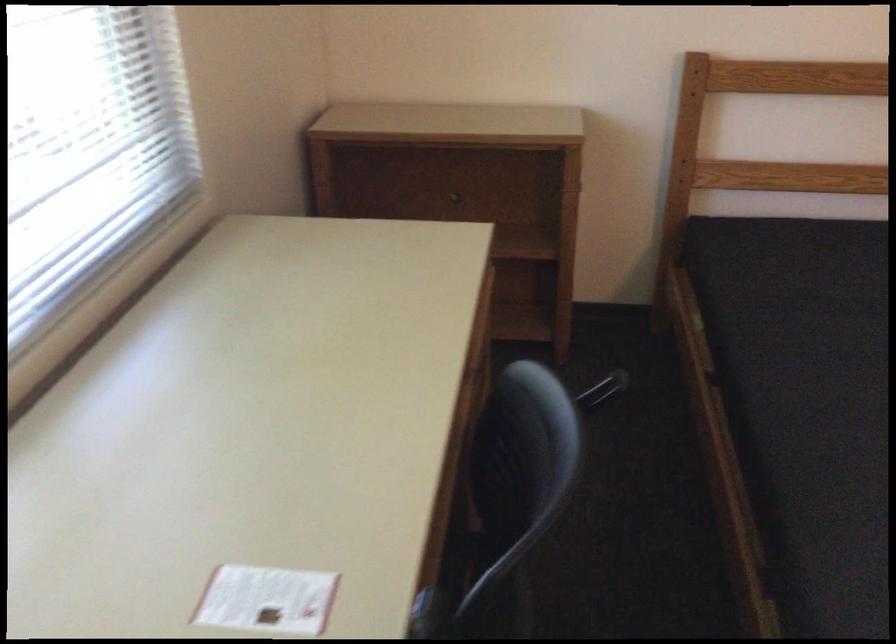
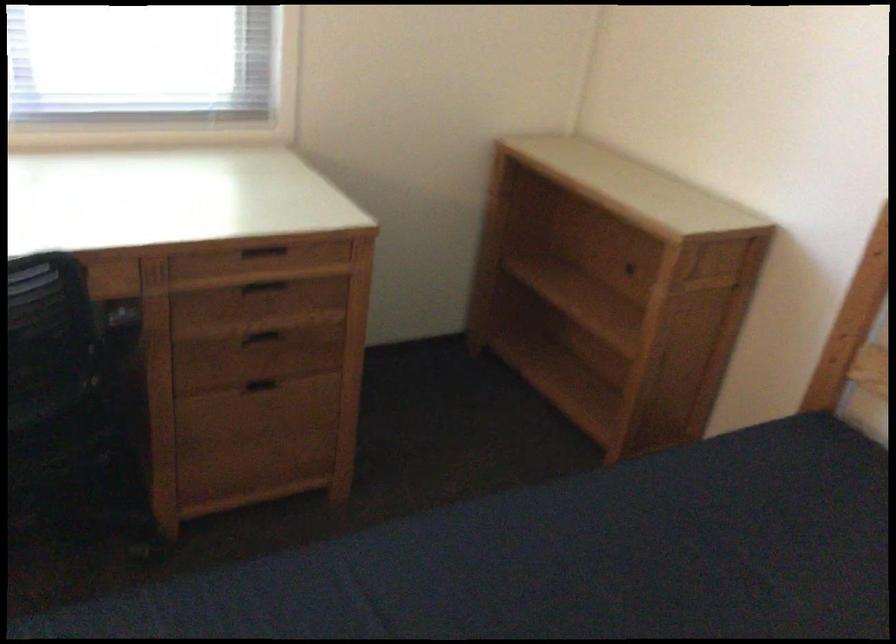
Locate, in the second image, the point that corresponds to (483,304) in the first image.

(263, 252)